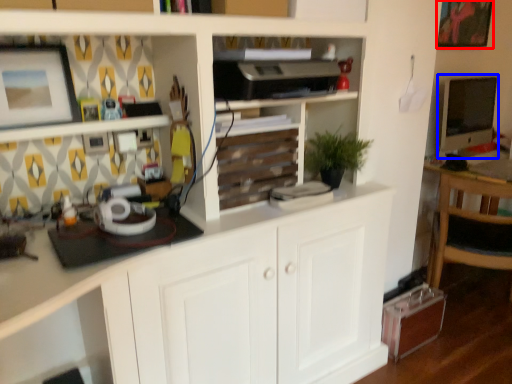
Question: Which point is closer to the camera, picture frame (highlighted by a red box) or computer monitor (highlighted by a blue box)?

Choices:
 (A) picture frame
 (B) computer monitor

Answer: (A)